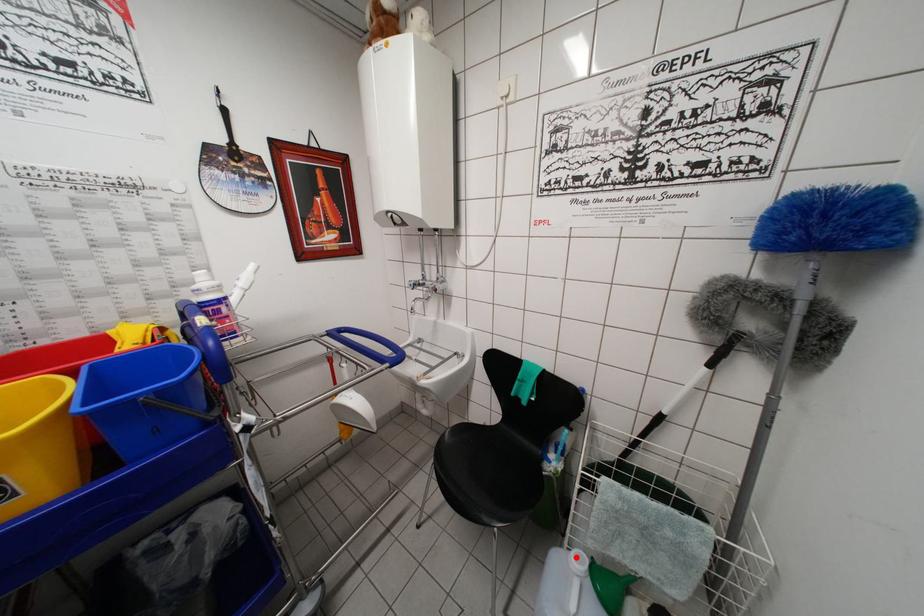
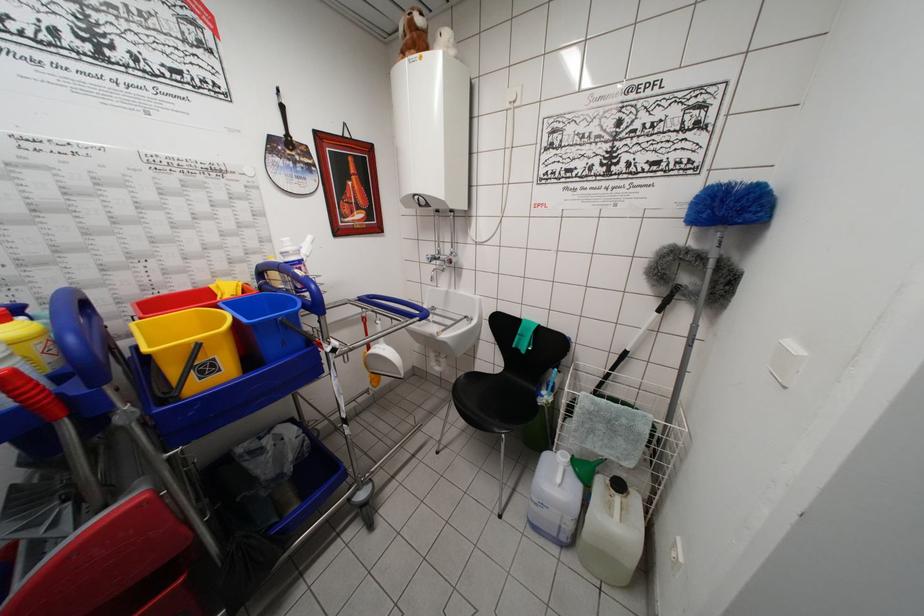
Question: I am providing you with two images of the same scene from different viewpoints. In image1, a red point is highlighted. Considering the same 3D point in image2, which of the following is correct?

Choices:
 (A) It is closer
 (B) It is farther

Answer: (A)